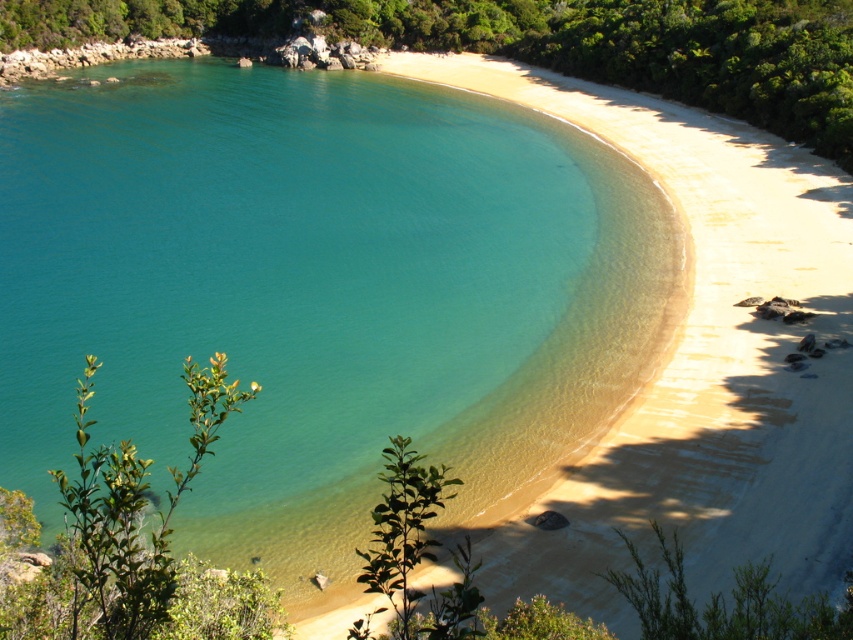
Is point (635, 72) closer to viewer compared to point (4, 618)?

No, it is behind (4, 618).

Can you confirm if green leafy shrub at upper left is shorter than green leafy shrub at lower left?

No.

Find the location of a particular element. Image resolution: width=853 pixels, height=640 pixels. green leafy shrub at upper left is located at coordinates (541, 44).

In order to click on green leafy shrub at upper left in this screenshot , I will do `click(541, 44)`.